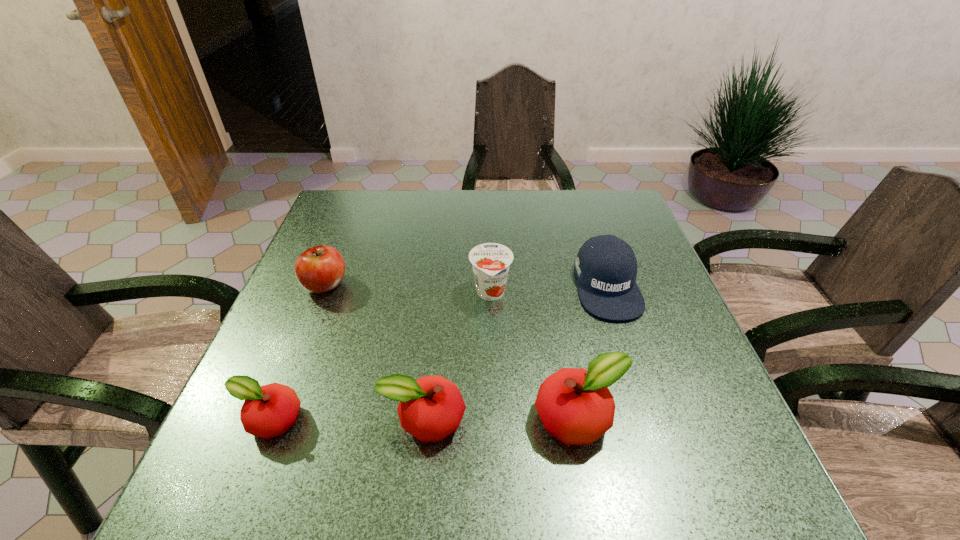
The apples are evenly distributed in the image. To maintain this, where would you place another apple on the right? Please point to a free space. Please provide its 2D coordinates. Your answer should be formatted as a tuple, i.e. [(x, y)], where the tuple contains the x and y coordinates of a point satisfying the conditions above.

[(733, 419)]